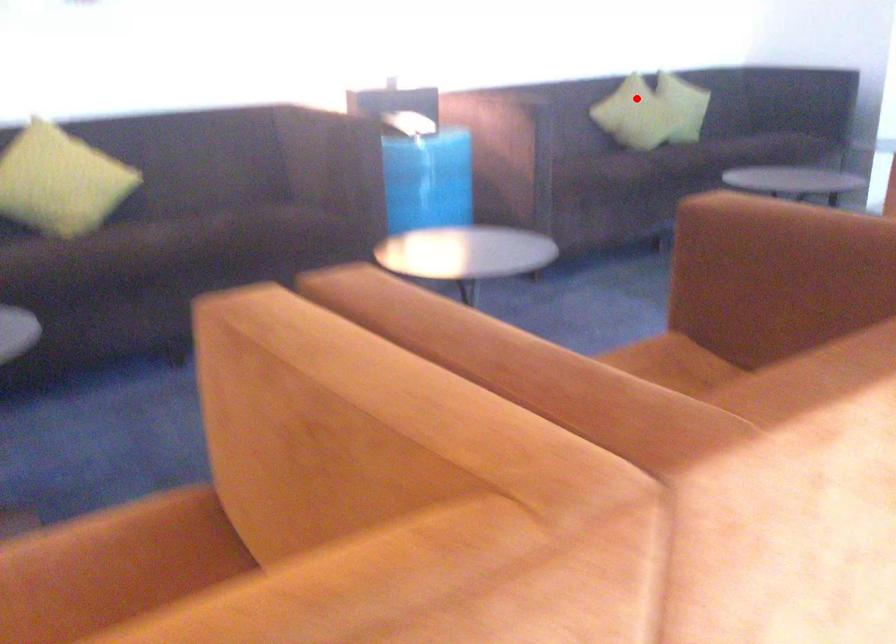
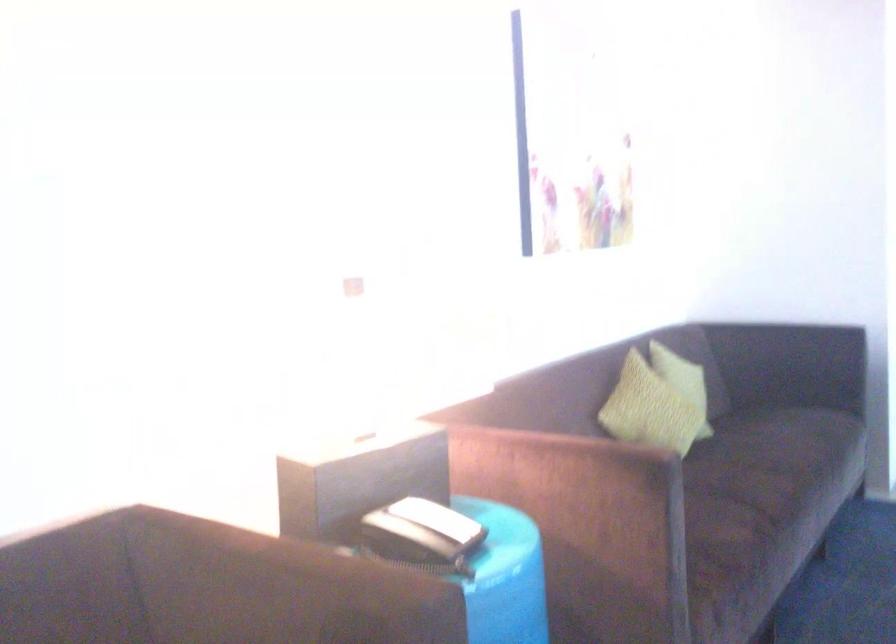
Question: A red point is marked in image1. In image2, is the corresponding 3D point closer to the camera or farther? Reply with the corresponding letter.

Choices:
 (A) The corresponding 3D point is closer.
 (B) The corresponding 3D point is farther.

Answer: (A)